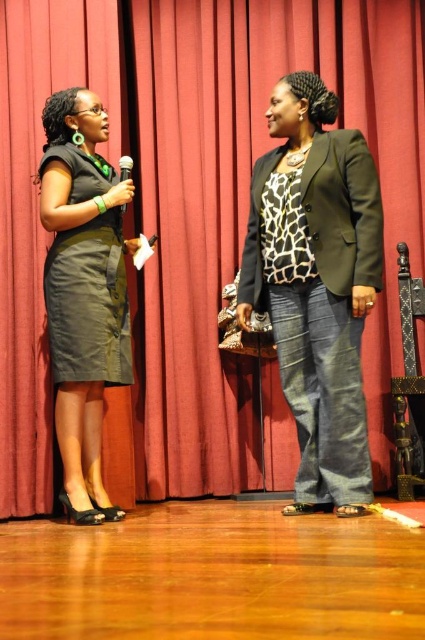
Consider the image. You are an event planner arranging a stage setup. You need to place a new decorative stand between the matte green blazer at center and the metallic silver microphone at center. Based on their current positions, which side of the microphone should the stand be placed to ensure it is between them?

The matte green blazer at center is to the right of the metallic silver microphone at center, so placing the decorative stand to the right side of the microphone will position it between the two objects.

You are a stagehand preparing to place a 12 inch wide decorative box between the matte green blazer at center and the metallic silver microphone at center. Considering their widths, will the box fit in the space between them?

The matte green blazer at center is wider than the metallic silver microphone at center. However, the exact distance between them isn not specified, so we cannot determine if the 12 inch box will fit solely based on their widths. More information about the space between them is needed.

You are a photographer setting up for a presentation. You need to place a small podium on the wooden floor at lower center so that it is directly in front of the matte black dress at left. Is the podium placement possible given their positions?

The wooden floor at lower center is below the matte black dress at left, so placing the podium directly in front of the dress would require positioning it on the floor beneath the dress, which is feasible as the floor is below and supports the dress.